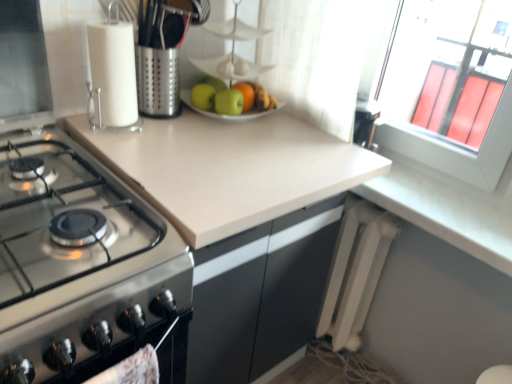
This screenshot has height=384, width=512. Find the location of `free spot to the right of green matte apple at center, which is the 1th apple from right to left`. free spot to the right of green matte apple at center, which is the 1th apple from right to left is located at coordinates (288, 127).